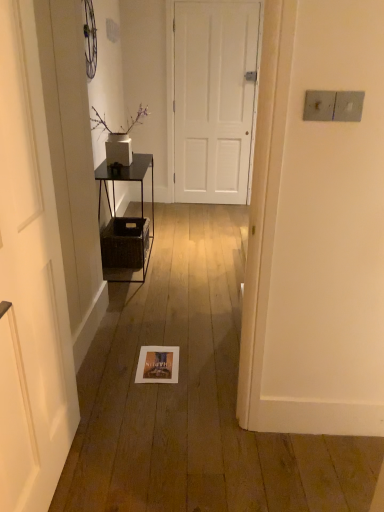
Question: Choose the correct answer: Is black metal shelf at left inside white matte door at left, which appears as the second door when viewed from the back, or outside it?

Choices:
 (A) inside
 (B) outside

Answer: (B)

Question: Relative to white matte door at left, the second door from the top, is black metal shelf at left in front or behind?

Choices:
 (A) front
 (B) behind

Answer: (B)

Question: Which is nearer to the black metal shelf at left?

Choices:
 (A) white matte door at left, which appears as the first door when viewed from the left
 (B) white matte door at center, arranged as the 2th door when ordered from the bottom
 (C) woven brown crate at left

Answer: (C)

Question: Estimate the real-world distances between objects in this image. Which object is farther from the black metal shelf at left?

Choices:
 (A) white matte door at left, which appears as the first door when viewed from the left
 (B) white matte door at center, the 1th door from the top
 (C) woven brown crate at left

Answer: (A)